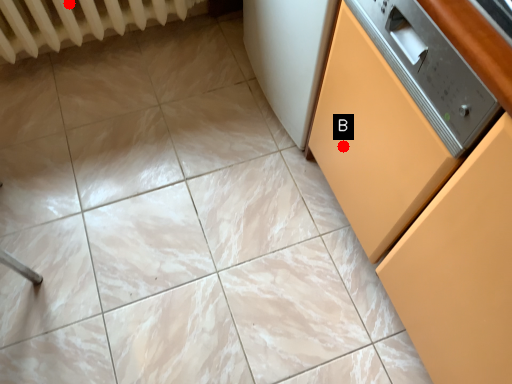
Question: Two points are circled on the image, labeled by A and B beside each circle. Which point is closer to the camera?

Choices:
 (A) A is closer
 (B) B is closer

Answer: (B)